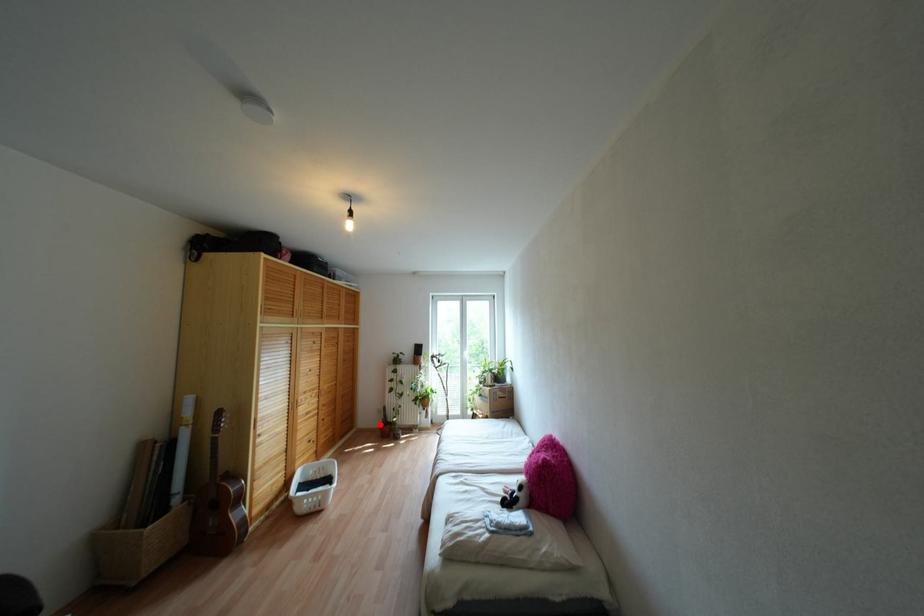
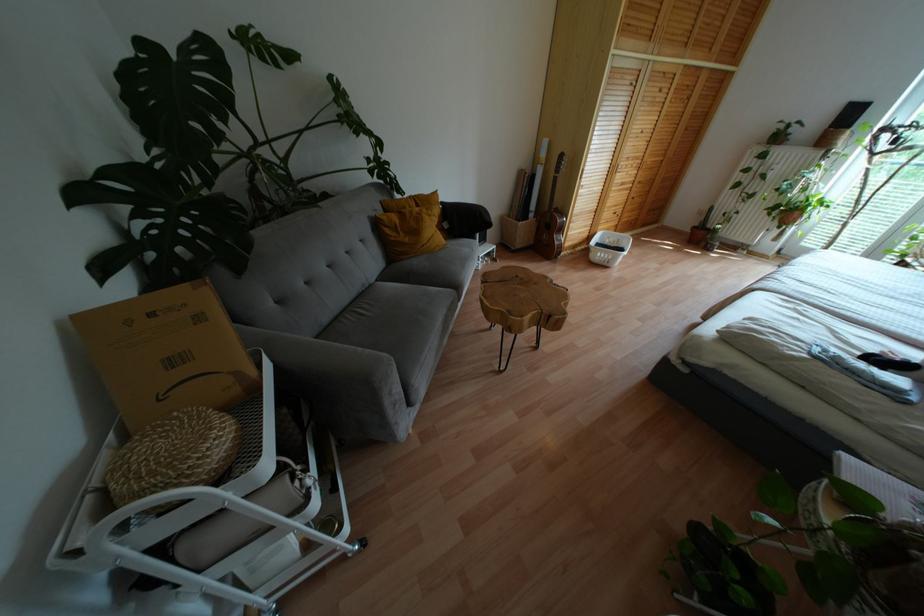
Question: I am providing you with two images of the same scene from different viewpoints. Image1 has a red point marked. In image2, the corresponding 3D location appears at what relative position? Reply with the corresponding letter.

Choices:
 (A) Closer
 (B) Farther

Answer: (A)